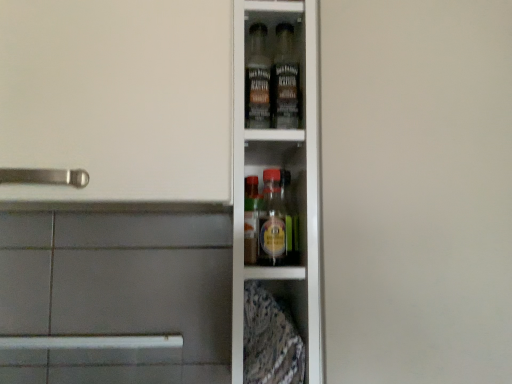
Question: In the image, is transparent glass cabinet at center on the left side or the right side of clear glass bottles at center?

Choices:
 (A) left
 (B) right

Answer: (B)

Question: From a real-world perspective, is transparent glass cabinet at center positioned above or below clear glass bottles at center?

Choices:
 (A) above
 (B) below

Answer: (A)

Question: From the image's perspective, is transparent glass cabinet at center above or below clear glass bottles at center?

Choices:
 (A) above
 (B) below

Answer: (A)

Question: From a real-world perspective, is clear glass bottles at center physically located above or below transparent glass cabinet at center?

Choices:
 (A) below
 (B) above

Answer: (A)

Question: Considering the positions of clear glass bottles at center and transparent glass cabinet at center in the image, is clear glass bottles at center bigger or smaller than transparent glass cabinet at center?

Choices:
 (A) big
 (B) small

Answer: (A)

Question: Does point (8, 329) appear closer or farther from the camera than point (446, 183)?

Choices:
 (A) closer
 (B) farther

Answer: (B)

Question: Considering the positions of clear glass bottles at center and transparent glass cabinet at center in the image, is clear glass bottles at center wider or thinner than transparent glass cabinet at center?

Choices:
 (A) thin
 (B) wide

Answer: (B)